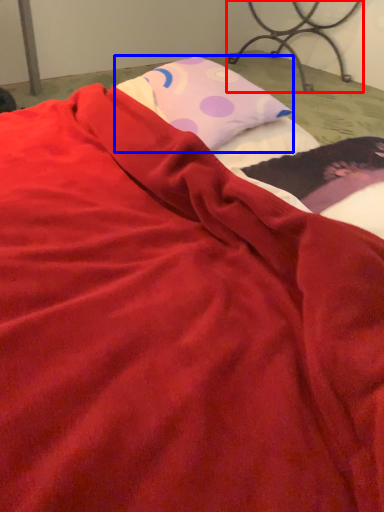
Question: Which point is further to the camera, furniture (highlighted by a red box) or pillow (highlighted by a blue box)?

Choices:
 (A) furniture
 (B) pillow

Answer: (A)